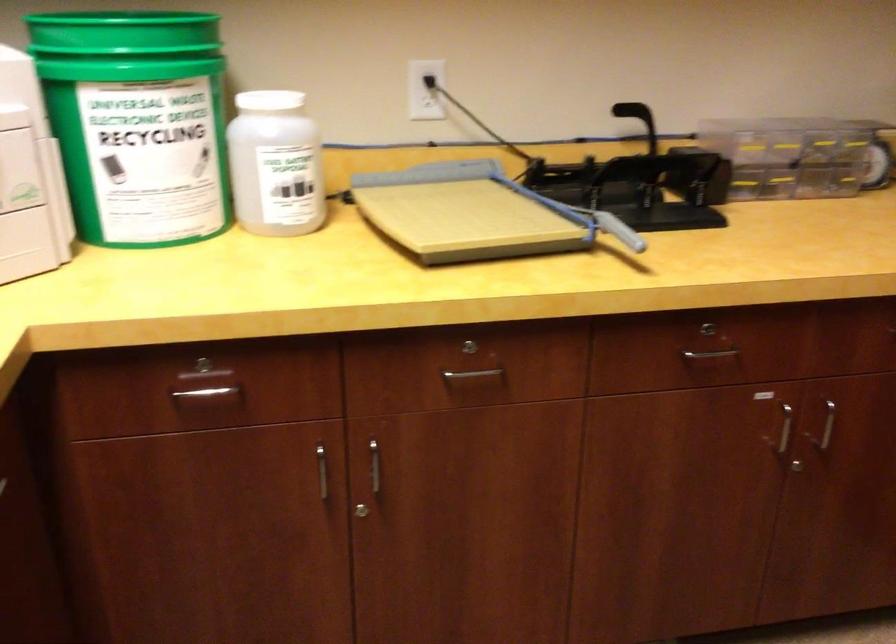
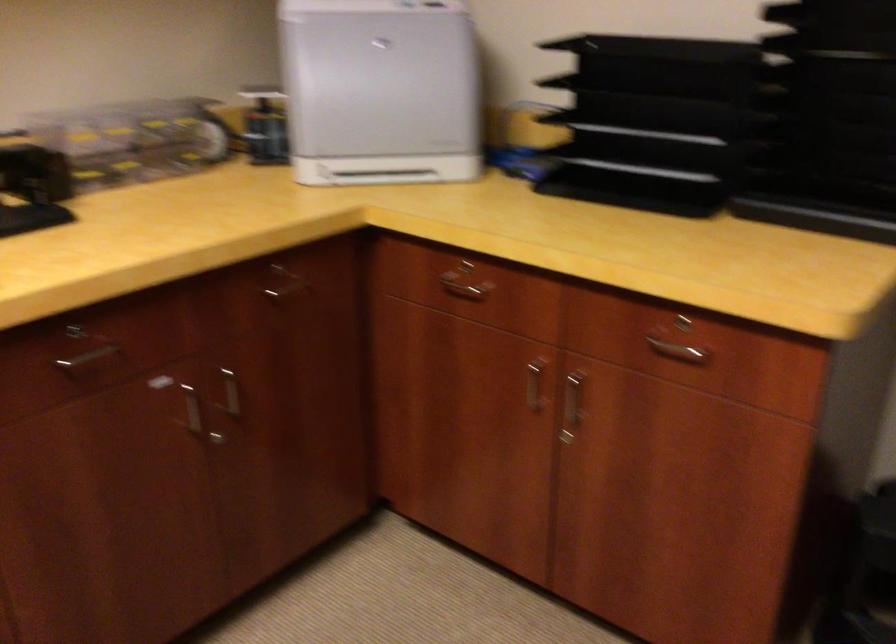
In the second image, find the point that corresponds to (x=824, y=433) in the first image.

(234, 395)